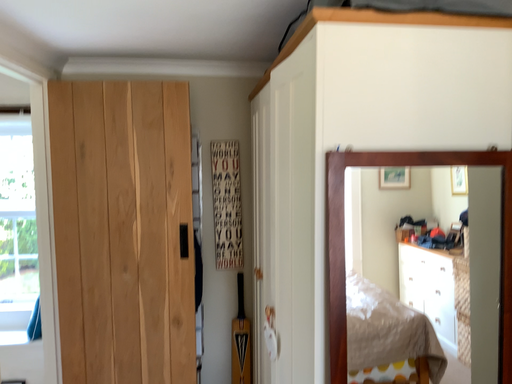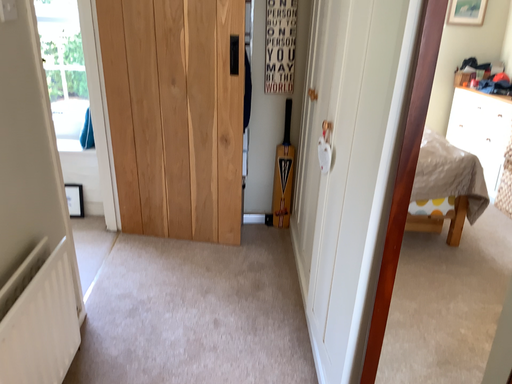
Question: Which way did the camera rotate in the video?

Choices:
 (A) rotated downward
 (B) rotated upward

Answer: (A)